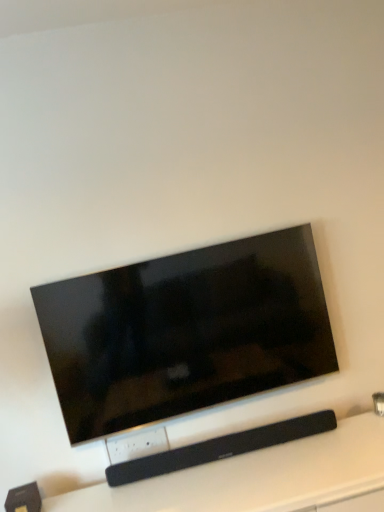
Question: Is matte black tv at center not inside black matte soundbar at center?

Choices:
 (A) yes
 (B) no

Answer: (A)

Question: Considering the relative sizes of matte black tv at center and black matte soundbar at center in the image provided, is matte black tv at center taller than black matte soundbar at center?

Choices:
 (A) yes
 (B) no

Answer: (A)

Question: Considering the relative positions of matte black tv at center and black matte soundbar at center in the image provided, is matte black tv at center to the right of black matte soundbar at center from the viewer's perspective?

Choices:
 (A) yes
 (B) no

Answer: (B)

Question: Can you see matte black tv at center touching black matte soundbar at center?

Choices:
 (A) yes
 (B) no

Answer: (B)

Question: Is matte black tv at center aimed at black matte soundbar at center?

Choices:
 (A) yes
 (B) no

Answer: (B)

Question: Can you confirm if matte black tv at center is thinner than black matte soundbar at center?

Choices:
 (A) yes
 (B) no

Answer: (A)

Question: Is black matte soundbar at center beside matte black tv at center?

Choices:
 (A) yes
 (B) no

Answer: (B)

Question: Considering the relative sizes of black matte soundbar at center and matte black tv at center in the image provided, is black matte soundbar at center thinner than matte black tv at center?

Choices:
 (A) no
 (B) yes

Answer: (A)

Question: Does black matte soundbar at center appear on the left side of matte black tv at center?

Choices:
 (A) no
 (B) yes

Answer: (A)

Question: Is black matte soundbar at center wider than matte black tv at center?

Choices:
 (A) no
 (B) yes

Answer: (B)

Question: Is black matte soundbar at center outside matte black tv at center?

Choices:
 (A) yes
 (B) no

Answer: (A)

Question: From the image's perspective, is black matte soundbar at center located beneath matte black tv at center?

Choices:
 (A) yes
 (B) no

Answer: (A)

Question: From the image's perspective, is matte black tv at center positioned above or below black matte soundbar at center?

Choices:
 (A) below
 (B) above

Answer: (B)